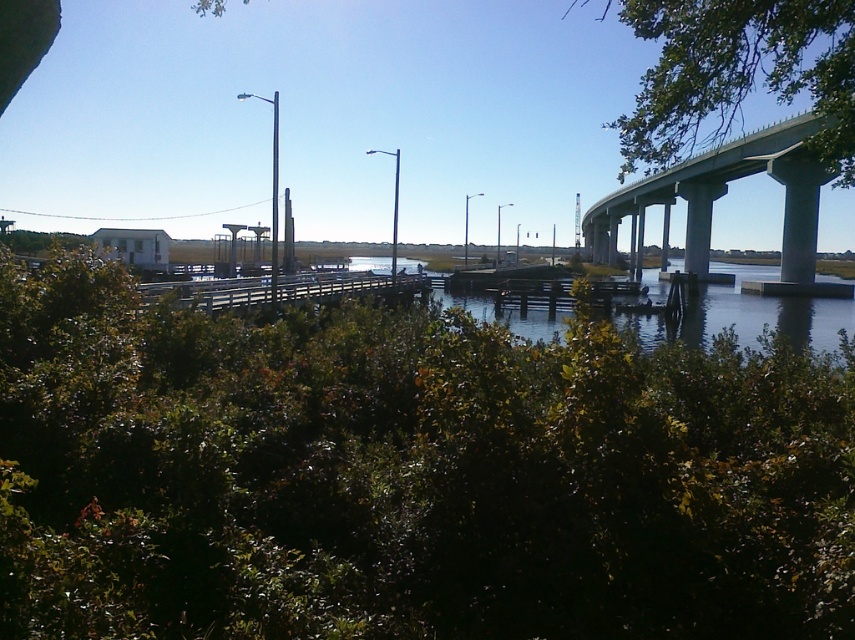
You are standing at the end of the pier and want to take a photo of both the green leafy tree at upper right and the gray concrete overpass at upper right. Which object should you position to your left to include both in the frame?

You should position the gray concrete overpass at upper right to your left because the green leafy tree at upper right is to the right of it, so placing the overpass on your left will allow both to be captured in the photo.

You are a hiker standing at the green leafy shrubs at lower center and want to reach the gray concrete overpass at upper right. Which direction should you move to get there?

You should move upward from the green leafy shrubs at lower center to reach the gray concrete overpass at upper right since the shrubs are located below the overpass.